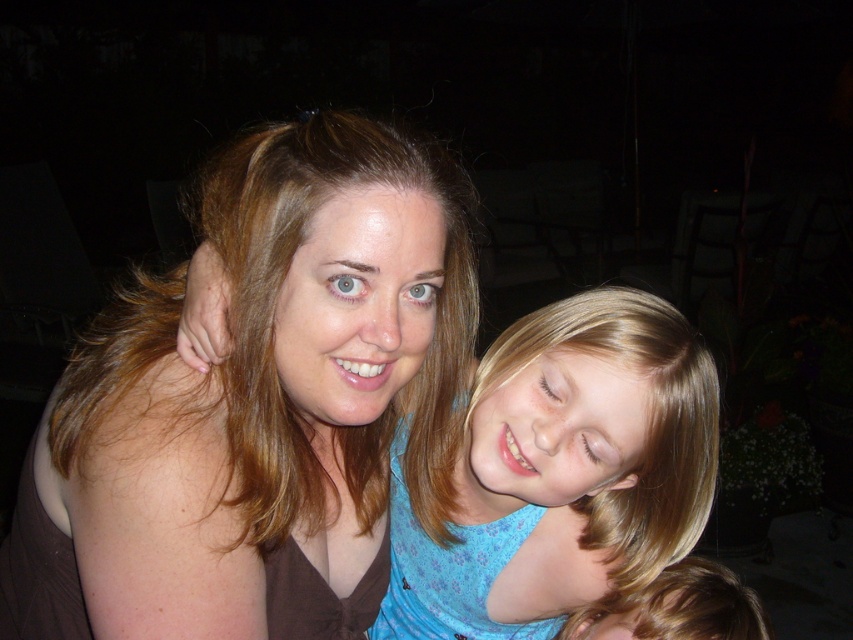
Between point (51, 554) and point (573, 492), which one is positioned behind?

Positioned behind is point (573, 492).

Who is lower down, matte brown shirt at center or blue floral shirt at center?

blue floral shirt at center is lower down.

Between point (286, 148) and point (532, 451), which one is positioned behind?

Point (532, 451)

Locate an element on the screen. matte brown shirt at center is located at coordinates (256, 404).